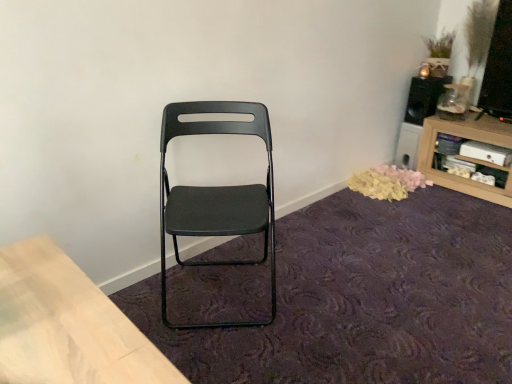
Question: Is black fabric chair at center located within matte black folding chair at center?

Choices:
 (A) yes
 (B) no

Answer: (B)

Question: Is matte black folding chair at center outside black fabric chair at center?

Choices:
 (A) no
 (B) yes

Answer: (B)

Question: Can you confirm if matte black folding chair at center is smaller than black fabric chair at center?

Choices:
 (A) yes
 (B) no

Answer: (B)

Question: From a real-world perspective, is matte black folding chair at center beneath black fabric chair at center?

Choices:
 (A) yes
 (B) no

Answer: (B)

Question: Considering the relative positions of matte black folding chair at center and black fabric chair at center in the image provided, is matte black folding chair at center to the left of black fabric chair at center from the viewer's perspective?

Choices:
 (A) yes
 (B) no

Answer: (A)

Question: Looking at their shapes, would you say matte black folding chair at center is wider or thinner than black fabric chair at center?

Choices:
 (A) thin
 (B) wide

Answer: (A)

Question: From a real-world perspective, is matte black folding chair at center above or below black fabric chair at center?

Choices:
 (A) below
 (B) above

Answer: (B)

Question: Do you think matte black folding chair at center is within black fabric chair at center, or outside of it?

Choices:
 (A) inside
 (B) outside

Answer: (B)

Question: Visually, is matte black folding chair at center positioned to the left or to the right of black fabric chair at center?

Choices:
 (A) left
 (B) right

Answer: (A)

Question: Looking at their shapes, would you say black matte speaker at upper right is wider or thinner than matte black folding chair at center?

Choices:
 (A) thin
 (B) wide

Answer: (A)

Question: Is black matte speaker at upper right bigger or smaller than matte black folding chair at center?

Choices:
 (A) big
 (B) small

Answer: (B)

Question: Considering their positions, is black matte speaker at upper right located in front of or behind matte black folding chair at center?

Choices:
 (A) behind
 (B) front

Answer: (A)

Question: Is black matte speaker at upper right taller or shorter than matte black folding chair at center?

Choices:
 (A) short
 (B) tall

Answer: (A)

Question: Does point (253, 201) appear closer or farther from the camera than point (394, 183)?

Choices:
 (A) farther
 (B) closer

Answer: (B)

Question: In the image, is matte black folding chair at center positioned in front of or behind yellow fabric petals at lower right?

Choices:
 (A) front
 (B) behind

Answer: (A)